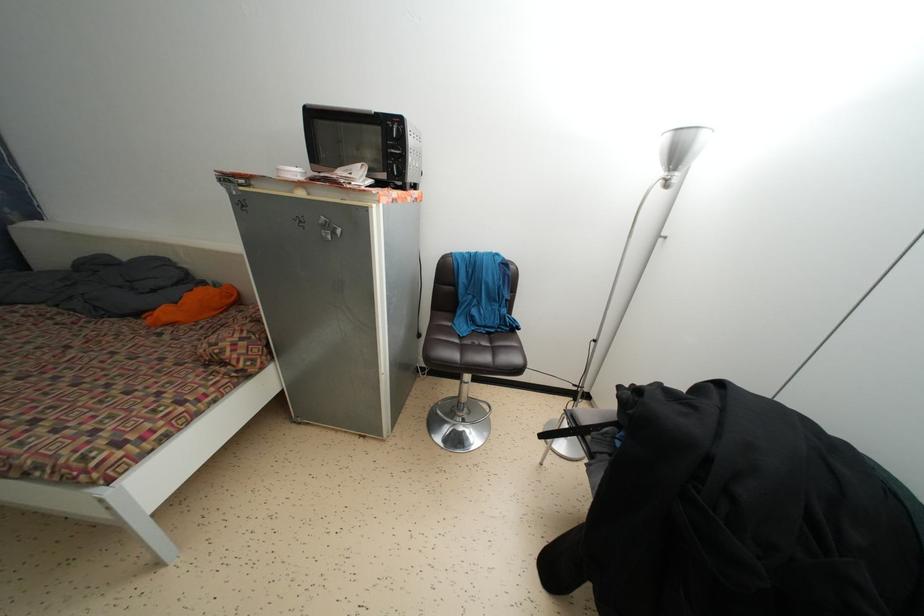
Find where to pull the silver fridge magnet. Please return your answer as a coordinate pair (x, y).

(329, 229)